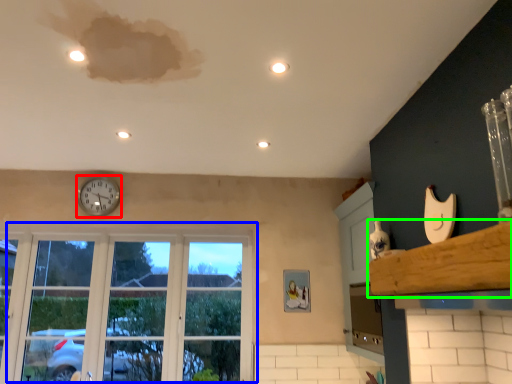
Question: Which object is the closest to the clock (highlighted by a red box)? Choose among these: window (highlighted by a blue box) or window sill (highlighted by a green box).

Choices:
 (A) window
 (B) window sill

Answer: (A)